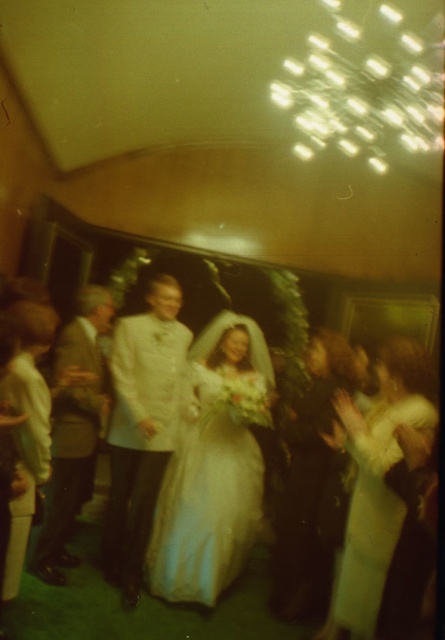
Which is more to the left, silky white gown at center or silky white dress at center?

From the viewer's perspective, silky white gown at center appears more on the left side.

In the scene shown: Measure the distance between silky white gown at center and camera.

silky white gown at center is 3.32 meters away from camera.

What do you see at coordinates (210, 488) in the screenshot? This screenshot has height=640, width=445. I see `silky white gown at center` at bounding box center [210, 488].

This screenshot has width=445, height=640. What are the coordinates of `silky white gown at center` in the screenshot? It's located at (210, 488).

Which is more to the left, white satin dress at center or light brown suit at center?

light brown suit at center is more to the left.

Is white satin dress at center shorter than light brown suit at center?

Correct, white satin dress at center is not as tall as light brown suit at center.

What do you see at coordinates (141, 598) in the screenshot? I see `white satin dress at center` at bounding box center [141, 598].

This screenshot has width=445, height=640. Find the location of `white satin dress at center`. white satin dress at center is located at coordinates (141, 598).

This screenshot has height=640, width=445. Describe the element at coordinates (312, 484) in the screenshot. I see `silky white dress at center` at that location.

Between silky white dress at center and light brown suit at center, which one appears on the right side from the viewer's perspective?

silky white dress at center

Find the location of a particular element. This screenshot has width=445, height=640. silky white dress at center is located at coordinates (312, 484).